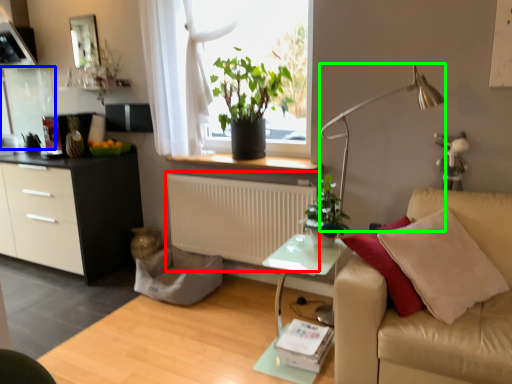
Question: Based on their relative distances, which object is nearer to radiator (highlighted by a red box)? Choose from glass door (highlighted by a blue box) and lamp (highlighted by a green box).

Choices:
 (A) glass door
 (B) lamp

Answer: (B)